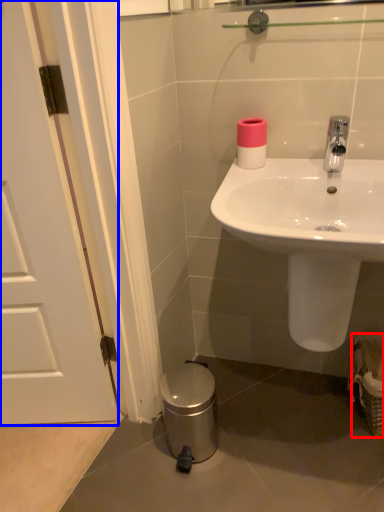
Question: Among these objects, which one is farthest to the camera, basket (highlighted by a red box) or door (highlighted by a blue box)?

Choices:
 (A) basket
 (B) door

Answer: (A)